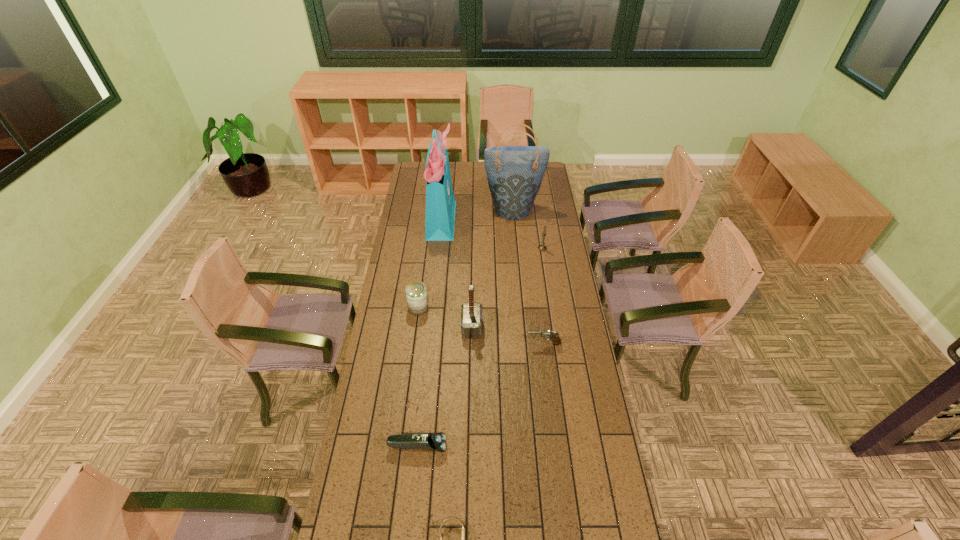
Locate an element on the screen. the left shopping bag is located at coordinates (440, 203).

This screenshot has height=540, width=960. Find the location of `the right shopping bag`. the right shopping bag is located at coordinates (514, 173).

The width and height of the screenshot is (960, 540). I want to click on the third tallest object, so click(471, 312).

At what (x,y) coordinates should I click in order to perform the action: click on the sixth nearest object. Please return your answer as a coordinate pair (x, y). Image resolution: width=960 pixels, height=540 pixels. Looking at the image, I should click on (542, 247).

The width and height of the screenshot is (960, 540). Identify the location of candle. (542, 247).

Identify the location of the fourth shortest object. This screenshot has height=540, width=960. (416, 294).

Identify the location of pistol. (553, 336).

Where is `the sixth tallest object`? the sixth tallest object is located at coordinates (553, 336).

At what (x,y) coordinates should I click in order to perform the action: click on the second nearest object. Please return your answer as a coordinate pair (x, y). This screenshot has height=540, width=960. Looking at the image, I should click on (434, 442).

The width and height of the screenshot is (960, 540). In order to click on the seventh tallest object in this screenshot , I will do `click(434, 442)`.